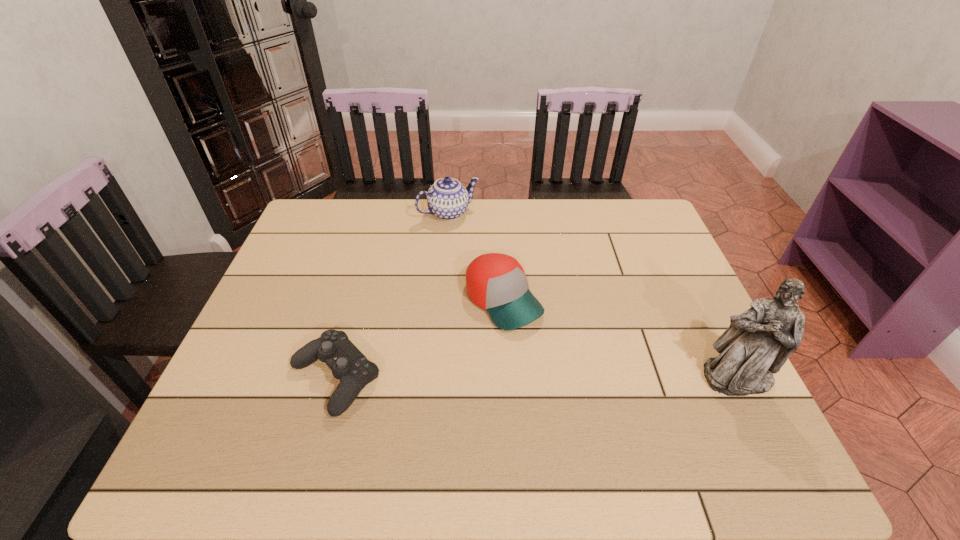
I want to click on vacant region located at the brim of the second farthest object, so [605, 415].

The image size is (960, 540). Identify the location of free space located 0.120m at the brim of the second farthest object. (559, 364).

The width and height of the screenshot is (960, 540). What are the coordinates of `vacant area situated at the spout of the second tallest object` in the screenshot? It's located at (500, 274).

You are a GUI agent. You are given a task and a screenshot of the screen. Output one action in this format:
    pyautogui.click(x=<x>, y=<y>)
    Task: Click on the vacant space positioned 0.150m at the spout of the second tallest object
    
    Given the screenshot: What is the action you would take?
    pyautogui.click(x=483, y=252)

Identify the location of vacant position located at the spout of the second tallest object. The image size is (960, 540). (471, 237).

At what (x,y) coordinates should I click in order to perform the action: click on object that is at the far edge. Please return your answer as a coordinate pair (x, y). This screenshot has width=960, height=540. Looking at the image, I should click on (447, 198).

Identify the location of control that is positioned at the near edge. Image resolution: width=960 pixels, height=540 pixels. (348, 364).

The width and height of the screenshot is (960, 540). Identify the location of figurine located in the near edge section of the desktop. (758, 342).

At what (x,y) coordinates should I click in order to perform the action: click on object present at the left edge. Please return your answer as a coordinate pair (x, y). This screenshot has height=540, width=960. Looking at the image, I should click on (348, 364).

Identify the location of object that is positioned at the right edge. Image resolution: width=960 pixels, height=540 pixels. (758, 342).